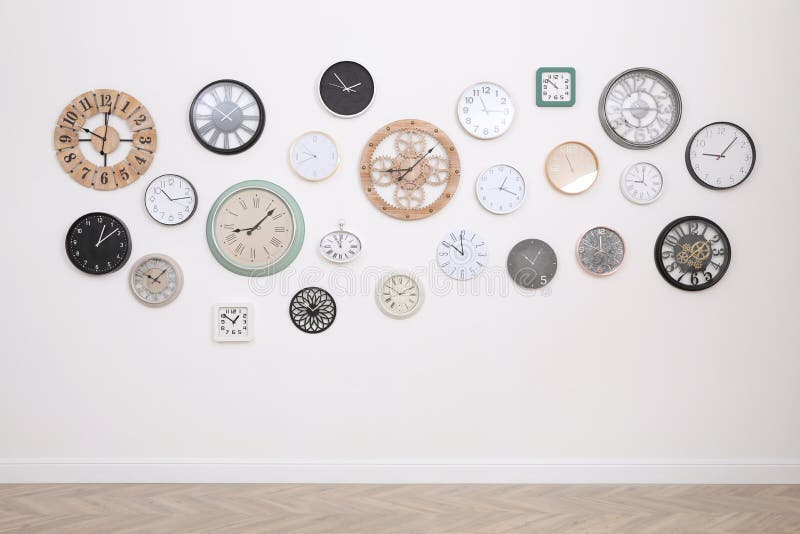
Locate an element on the screen. Image resolution: width=800 pixels, height=534 pixels. black clocks is located at coordinates (90, 235), (346, 93), (314, 315), (533, 265), (702, 249), (640, 106).